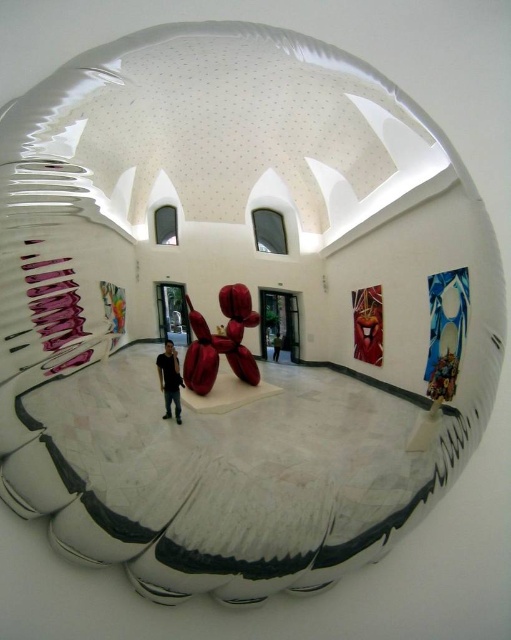
You are standing in the art gallery and want to get a better look at the metallic sculpture in the center. If you move forward 10 centimeters, will you be closer to the dark gray shirt at center than you were before?

Yes, moving forward 10 centimeters will decrease the distance between you and the dark gray shirt at center, making you closer than before.

You are an art critic standing at the entrance of the gallery. You notice two points marked on the floor at coordinates point (378,301) and point (277,346). If you want to move from the entrance to the point that is closer to the large metallic sculpture in the center, which coordinate should you head towards?

Point (277,346) is closer to the large metallic sculpture in the center because it is in front of point (378,301), which is behind it.

You are an art curator planning to move the dark brown leather jacket at center closer to the metallic red sculpture at right. Considering their sizes, which object will occupy more space after moving?

The metallic red sculpture at right is larger in size than the dark brown leather jacket at center, so it will occupy more space even after moving the jacket closer.